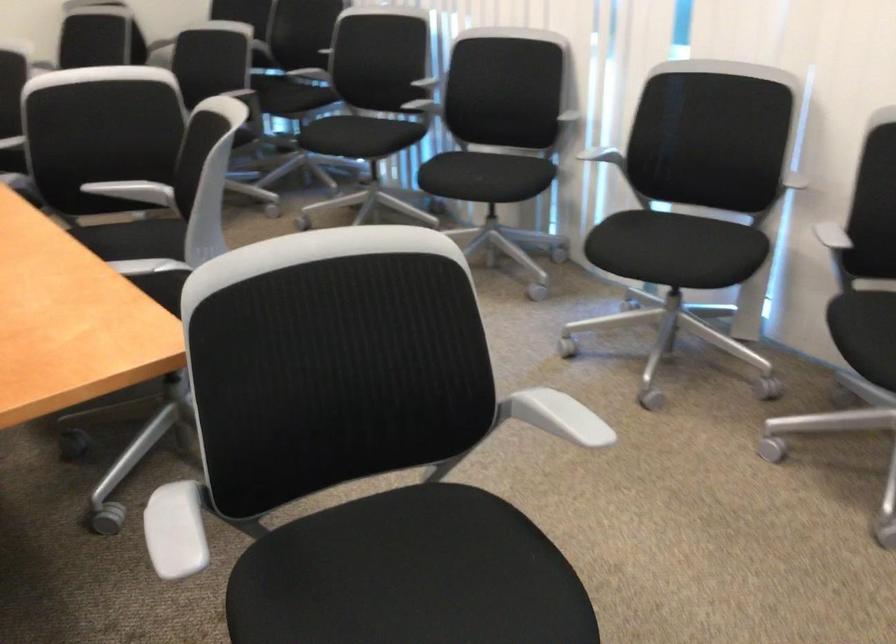
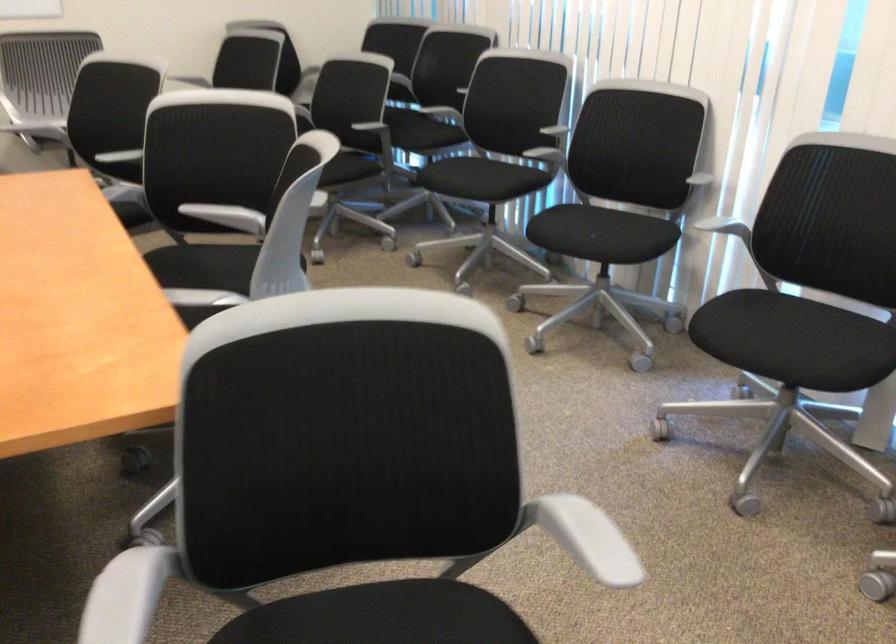
The point at (471,178) is marked in the first image. Where is the corresponding point in the second image?

(582, 232)